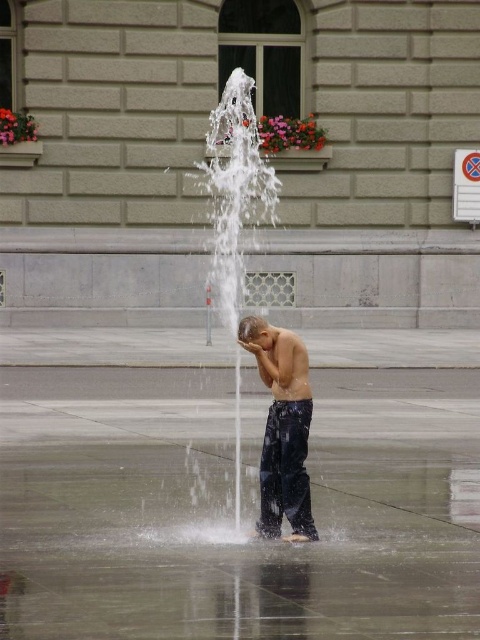
Question: Which point is farther to the camera?

Choices:
 (A) white frothy water at center
 (B) dark blue jeans at center

Answer: (A)

Question: Can you confirm if white frothy water at center is positioned to the left of dark blue jeans at center?

Choices:
 (A) no
 (B) yes

Answer: (B)

Question: From the image, what is the correct spatial relationship of white frothy water at center in relation to dark blue jeans at center?

Choices:
 (A) right
 (B) left

Answer: (B)

Question: Among these objects, which one is farthest from the camera?

Choices:
 (A) white frothy water at center
 (B) dark blue jeans at center

Answer: (A)

Question: Does white frothy water at center appear under dark blue jeans at center?

Choices:
 (A) no
 (B) yes

Answer: (A)